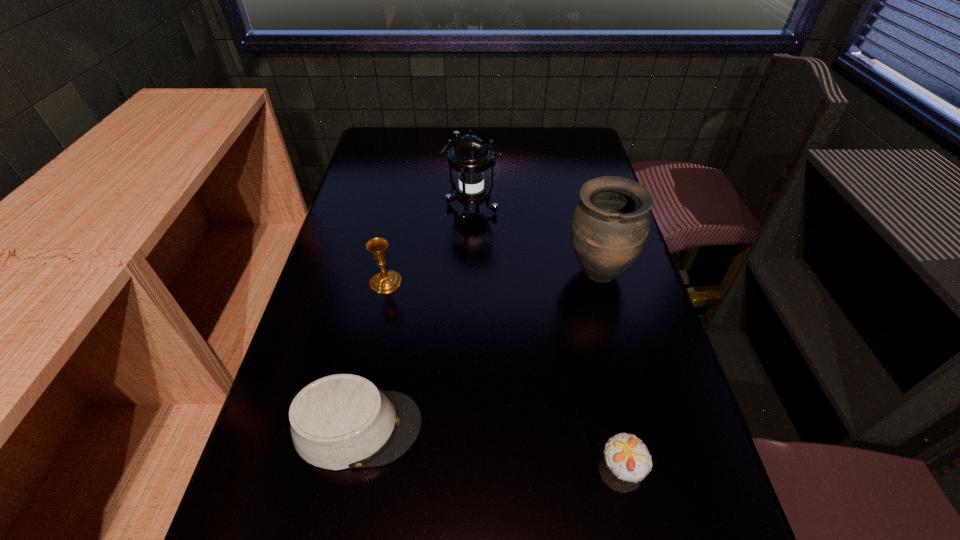
The width and height of the screenshot is (960, 540). Identify the location of vacant point that satisfies the following two spatial constraints: 1. on the front-facing side of the cupcake; 2. on the left side of the hat. (x=349, y=470).

Locate an element on the screen. This screenshot has height=540, width=960. vacant space that satisfies the following two spatial constraints: 1. on the front side of the third tallest object; 2. on the left side of the cupcake is located at coordinates (347, 470).

Where is `vacant region that satisfies the following two spatial constraints: 1. on the back side of the farthest object; 2. on the left side of the third tallest object`? Image resolution: width=960 pixels, height=540 pixels. vacant region that satisfies the following two spatial constraints: 1. on the back side of the farthest object; 2. on the left side of the third tallest object is located at coordinates (400, 209).